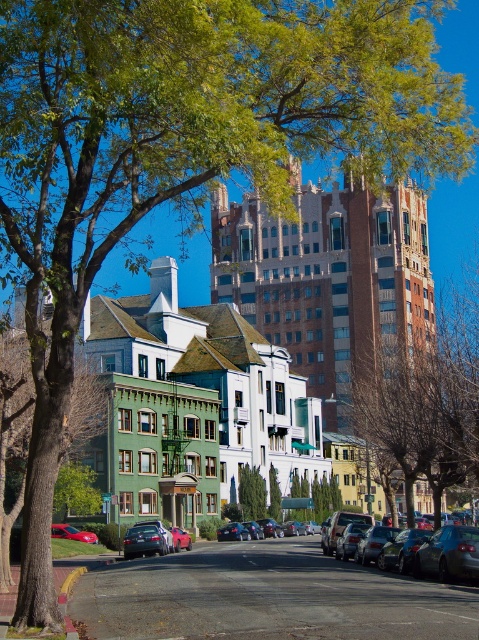
Question: Among these points, which one is nearest to the camera?

Choices:
 (A) (95, 397)
 (B) (399, 456)
 (C) (228, 531)
 (D) (175, 529)

Answer: (B)

Question: Where is brown textured building at center located in relation to shiny red car at lower left in the image?

Choices:
 (A) above
 (B) below

Answer: (A)

Question: Among these objects, which one is nearest to the camera?

Choices:
 (A) green textured tree at left
 (B) shiny red car at lower left
 (C) shiny black sedan at center
 (D) metallic blue sedan at center

Answer: (A)

Question: Which point is farther to the camera?

Choices:
 (A) (456, 356)
 (B) (230, 534)
 (C) (445, 566)
 (D) (144, 529)

Answer: (A)

Question: Is brown brick building at upper center wider than metallic silver sedan at center?

Choices:
 (A) no
 (B) yes

Answer: (B)

Question: Does brown brick building at upper center appear over shiny black sedan at center?

Choices:
 (A) no
 (B) yes

Answer: (B)